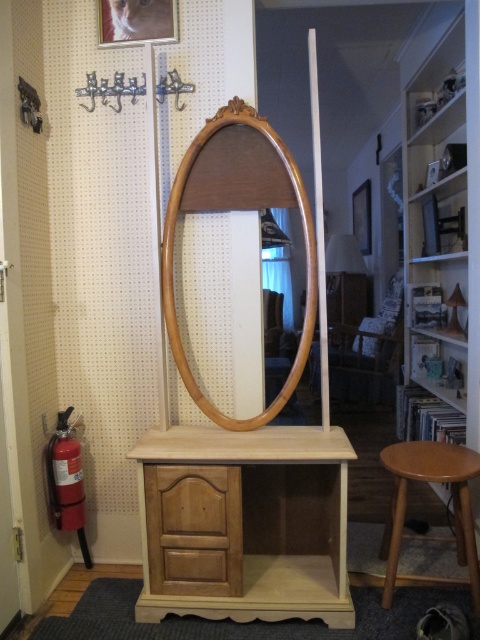
In the scene shown: You are moving a 16 inch wide decorative item to place between the wooden mirror at center and the light brown wood drawer at center. Based on the space available, will it fit?

The distance between the wooden mirror at center and the light brown wood drawer at center is 18.30 inches. Since the decorative item is 16 inches wide, it will fit within the space.

Based on the photo, you are organizing a small party and need to place a decorative item on the wooden mirror at center and the light brown wood drawer at center. Which surface will the item be placed higher up?

The wooden mirror at center is above the light brown wood drawer at center, so placing the item on the wooden mirror at center will be higher up.